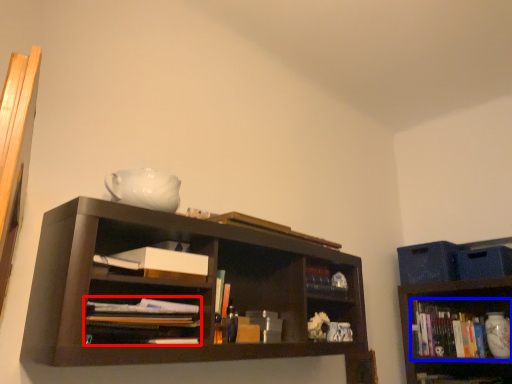
Question: Which object appears farthest to the camera in this image, book (highlighted by a red box) or book (highlighted by a blue box)?

Choices:
 (A) book
 (B) book

Answer: (B)